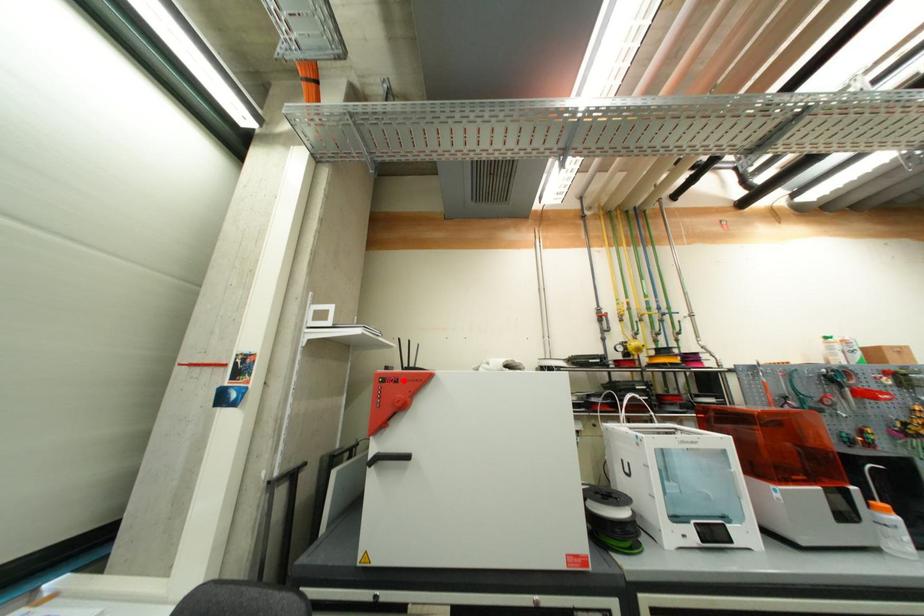
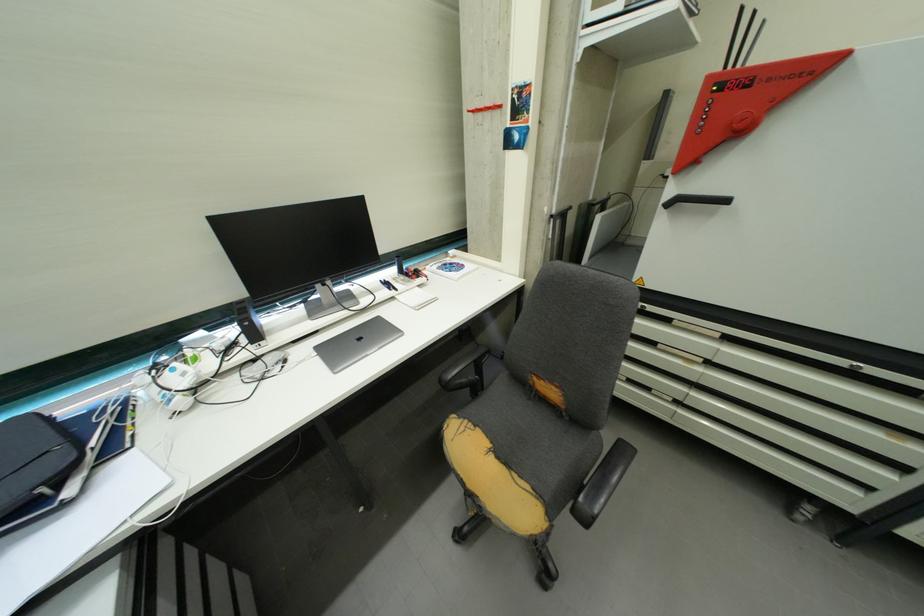
Find the pixel in the second image that matches the highlighted location in the first image.

(759, 81)